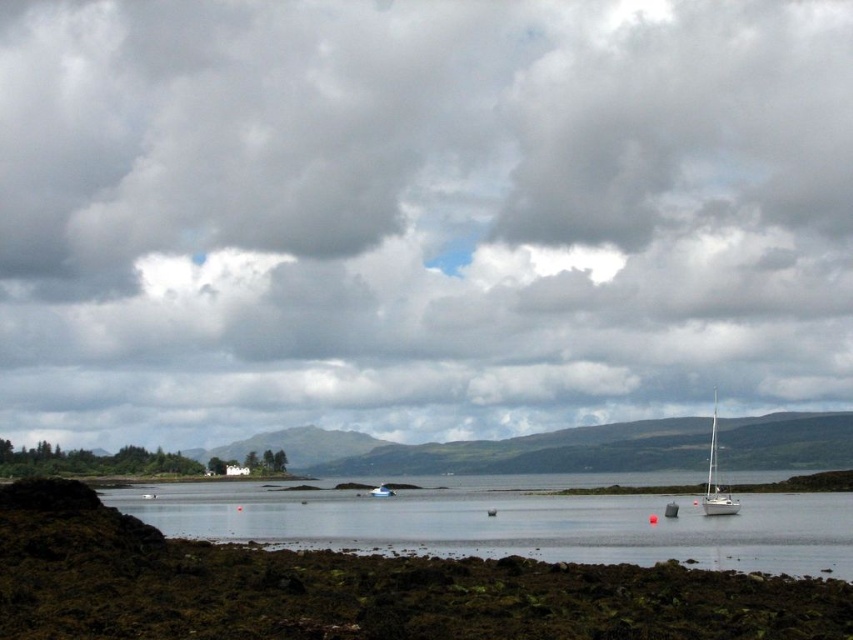
Can you confirm if clear water at center is bigger than white plastic boat at center?

Yes.

What do you see at coordinates (514, 522) in the screenshot?
I see `clear water at center` at bounding box center [514, 522].

Find the location of a particular element. This screenshot has height=640, width=853. clear water at center is located at coordinates (514, 522).

Between cloudy sky at upper center and white plastic boat at center, which one appears on the right side from the viewer's perspective?

Positioned to the right is cloudy sky at upper center.

Is cloudy sky at upper center to the left of white plastic boat at center from the viewer's perspective?

No, cloudy sky at upper center is not to the left of white plastic boat at center.

Between point (585, 92) and point (386, 486), which one is positioned in front?

Point (386, 486)

What are the coordinates of `cloudy sky at upper center` in the screenshot? It's located at (418, 212).

In the scene shown: How far apart are white glossy sailboat at lower right and white plastic boat at center?

white glossy sailboat at lower right and white plastic boat at center are 54.15 meters apart from each other.

Between point (728, 512) and point (381, 496), which one is positioned in front?

Point (728, 512) is in front.

Locate an element on the screen. The height and width of the screenshot is (640, 853). white glossy sailboat at lower right is located at coordinates point(715,477).